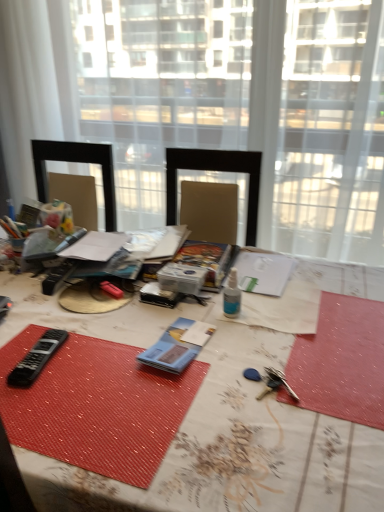
Question: Considering the positions of black plastic remote at lower left, the first equipment from the left, and blue paper at center, the first equipment when ordered from right to left, in the image, is black plastic remote at lower left, the first equipment from the left, bigger or smaller than blue paper at center, the first equipment when ordered from right to left,?

Choices:
 (A) big
 (B) small

Answer: (B)

Question: Is point (36, 373) positioned closer to the camera than point (183, 360)?

Choices:
 (A) farther
 (B) closer

Answer: (B)

Question: Based on their relative distances, which object is farther from the white textured table at center?

Choices:
 (A) transparent glass window at center, acting as the 2th window starting from the left
 (B) blue paper at center, the first equipment when ordered from right to left
 (C) black plastic remote at lower left, the second equipment positioned from the right
 (D) transparent glass window at center, the second window viewed from the right

Answer: (D)

Question: Considering the real-world distances, which object is farthest from the black plastic remote at lower left, the first equipment from the left?

Choices:
 (A) transparent glass window at center, the second window viewed from the right
 (B) blue paper at center, the first equipment when ordered from right to left
 (C) transparent glass window at center, acting as the 2th window starting from the left
 (D) white textured table at center

Answer: (A)